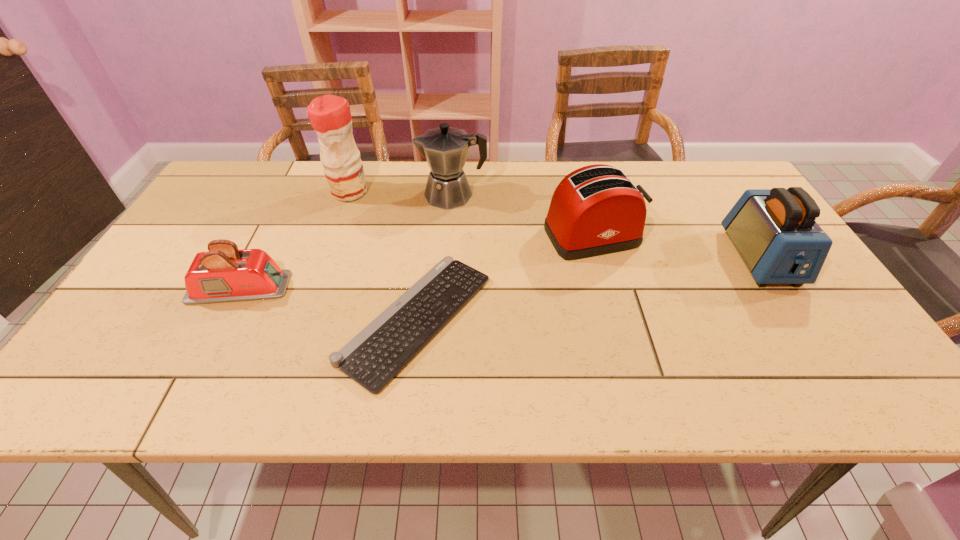
The width and height of the screenshot is (960, 540). Find the location of `vacant point located between the shortest object and the second toaster from right to left`. vacant point located between the shortest object and the second toaster from right to left is located at coordinates (505, 278).

This screenshot has height=540, width=960. In order to click on vacant space in between the tallest object and the second toaster from left to right in this screenshot , I will do `click(471, 214)`.

You are a GUI agent. You are given a task and a screenshot of the screen. Output one action in this format:
    pyautogui.click(x=<x>, y=<y>)
    Task: Click on the vacant space that is in between the coffeepot and the computer keyboard
    This screenshot has height=540, width=960.
    Given the screenshot: What is the action you would take?
    pyautogui.click(x=435, y=257)

Identify which object is the fifth nearest to the rightmost object. Please provide its 2D coordinates. Your answer should be formatted as a tuple, i.e. [(x, y)], where the tuple contains the x and y coordinates of a point satisfying the conditions above.

[(224, 274)]

Select which object is the third closest to the leftmost object. Please provide its 2D coordinates. Your answer should be formatted as a tuple, i.e. [(x, y)], where the tuple contains the x and y coordinates of a point satisfying the conditions above.

[(445, 148)]

Identify the location of toaster that is the third nearest to the condiment. The width and height of the screenshot is (960, 540). (774, 230).

The image size is (960, 540). Identify the location of toaster that is the second nearest to the coffeepot. (224, 274).

Locate an element on the screen. vacant space that satisfies the following two spatial constraints: 1. on the back side of the tallest object; 2. on the right side of the shortest toaster is located at coordinates (289, 192).

The width and height of the screenshot is (960, 540). Find the location of `vacant region that satisfies the following two spatial constraints: 1. on the back side of the fifth object from left to right; 2. on the right side of the leftmost object`. vacant region that satisfies the following two spatial constraints: 1. on the back side of the fifth object from left to right; 2. on the right side of the leftmost object is located at coordinates (266, 236).